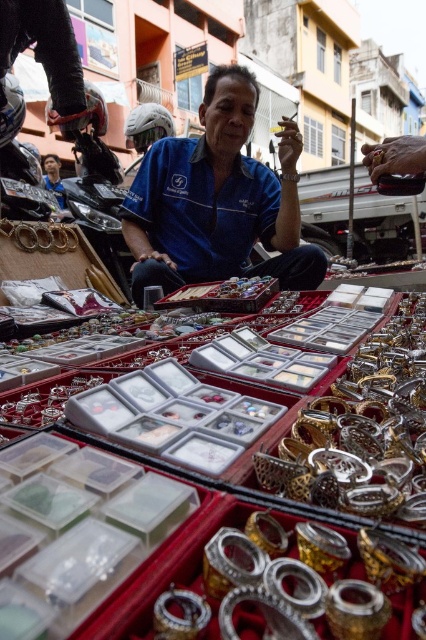
You are a customer at the jewelry stall. You see the gold metallic bangles at center and the gold metallic bracelet at center. Which one is positioned lower in the display?

The gold metallic bangles at center is located below the gold metallic bracelet at center, so it is positioned lower in the display.

You are a customer at the jewelry vendor stall. You see a point marked at coordinates (362, 428). What jewelry item is located at that point?

The point at coordinates (362, 428) corresponds to the gold metallic rings at center.